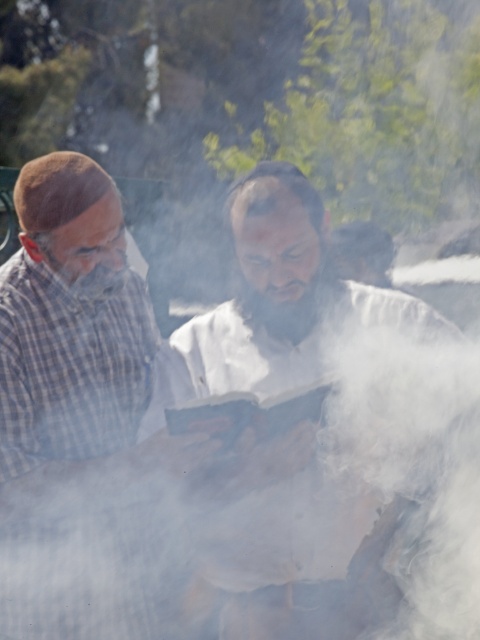
You are a photographer trying to capture a clear shot of the white matte book at center and the plaid fabric shirt at left. Since the scene is filled with smoke, which object might be easier to see clearly in the photo?

The white matte book at center has a larger size compared to the plaid fabric shirt at left, so it might be easier to see clearly in the photo despite the smoke.

What is the object located at the coordinates point (319,435) in the image?

The point (319,435) indicates the white matte book at center.

You are an observer trying to determine which object is taller between the white matte book at center and the plaid fabric shirt at left. Based on the scene description, which one is taller?

The white matte book at center is taller than the plaid fabric shirt at left according to the description.